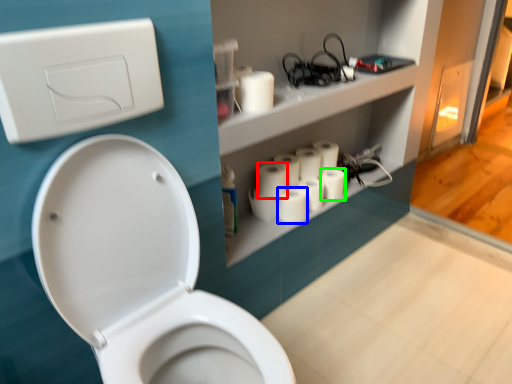
Question: Based on their relative distances, which object is farther from toilet paper (highlighted by a red box)? Choose from toilet paper (highlighted by a blue box) and toilet paper (highlighted by a green box).

Choices:
 (A) toilet paper
 (B) toilet paper

Answer: (B)